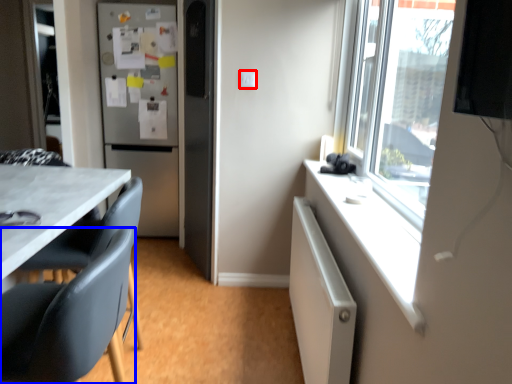
Question: Among these objects, which one is farthest to the camera, electric outlet (highlighted by a red box) or chair (highlighted by a blue box)?

Choices:
 (A) electric outlet
 (B) chair

Answer: (A)